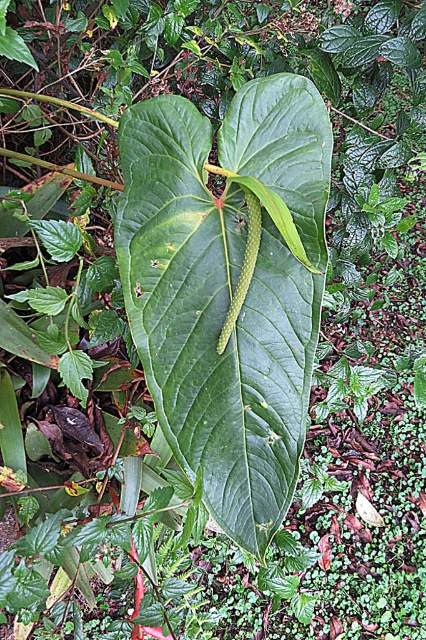
Is green matte leaf at center taller than green smooth caterpillar at center?

Yes.

Consider the image. Can you confirm if green matte leaf at center is shorter than green smooth caterpillar at center?

No.

Does point (149, 154) come behind point (247, 273)?

Yes, point (149, 154) is behind point (247, 273).

At what (x,y) coordinates should I click in order to perform the action: click on green matte leaf at center. Please return your answer as a coordinate pair (x, y). Looking at the image, I should click on (229, 285).